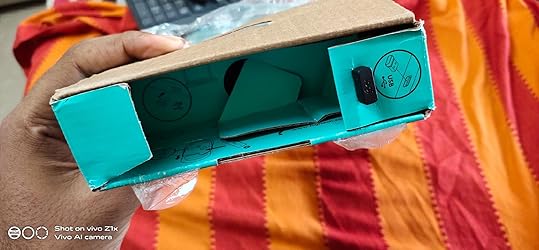
The width and height of the screenshot is (539, 250). I want to click on computer, so click(x=170, y=18).